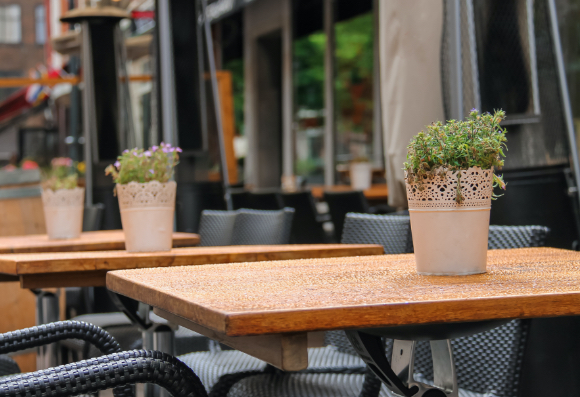
Identify the location of chair arms. Image resolution: width=580 pixels, height=397 pixels. (134, 359), (100, 351), (81, 320), (188, 382), (180, 365), (81, 389), (21, 343), (55, 327).